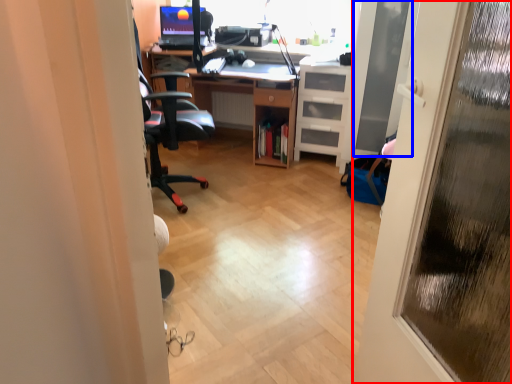
Question: Which point is further to the camera, door (highlighted by a red box) or screen door (highlighted by a blue box)?

Choices:
 (A) door
 (B) screen door

Answer: (B)